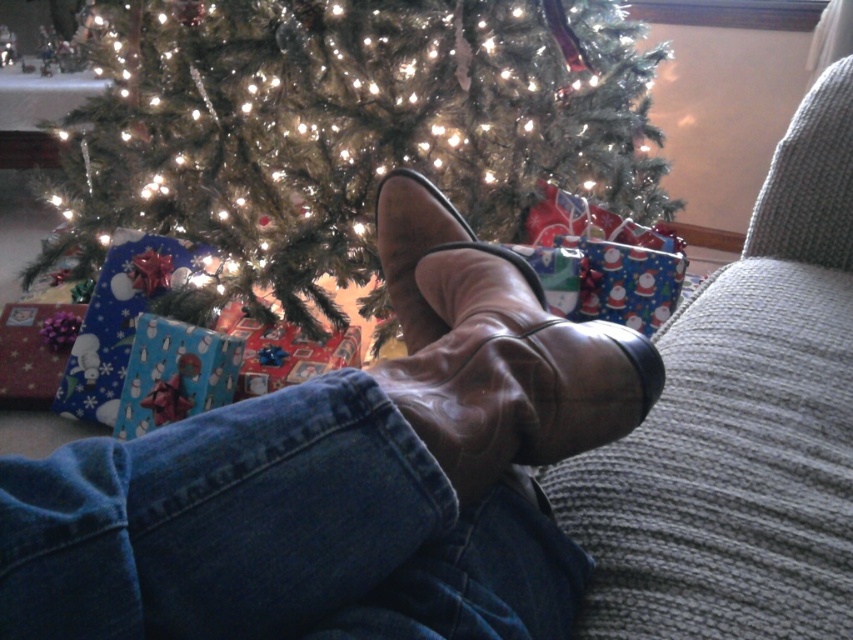
Question: Among these points, which one is farthest from the camera?

Choices:
 (A) [612, 428]
 (B) [119, 40]

Answer: (B)

Question: Does leather shoe at lower center have a lesser width compared to green matte christmas tree at center?

Choices:
 (A) no
 (B) yes

Answer: (B)

Question: Which point is closer to the camera?

Choices:
 (A) green matte christmas tree at center
 (B) leather shoe at lower center

Answer: (B)

Question: Is leather shoe at lower center bigger than green matte christmas tree at center?

Choices:
 (A) yes
 (B) no

Answer: (B)

Question: Which point is farther to the camera?

Choices:
 (A) leather shoe at lower center
 (B) green matte christmas tree at center

Answer: (B)

Question: From the image, what is the correct spatial relationship of leather shoe at lower center in relation to green matte christmas tree at center?

Choices:
 (A) left
 (B) right

Answer: (B)